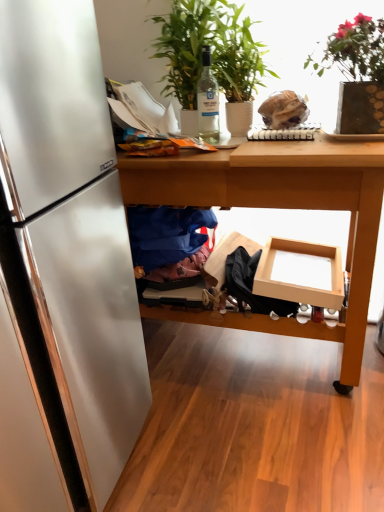
Question: Should I look upward or downward to see green leafy plant at upper center, placed as the first houseplant when sorted from left to right?

Choices:
 (A) up
 (B) down

Answer: (A)

Question: Should I look upward or downward to see blue fabric at lower center?

Choices:
 (A) down
 (B) up

Answer: (B)

Question: Would you say blue fabric at lower center is part of green leafy plant at upper center, placed as the first houseplant when sorted from left to right,'s contents?

Choices:
 (A) yes
 (B) no

Answer: (B)

Question: Is green leafy plant at upper center, placed as the first houseplant when sorted from left to right, thinner than blue fabric at lower center?

Choices:
 (A) yes
 (B) no

Answer: (B)

Question: Is green leafy plant at upper center, the second houseplant positioned from the right, oriented towards blue fabric at lower center?

Choices:
 (A) yes
 (B) no

Answer: (B)

Question: From a real-world perspective, is green leafy plant at upper center, the second houseplant positioned from the right, physically below blue fabric at lower center?

Choices:
 (A) no
 (B) yes

Answer: (A)

Question: From the image's perspective, does green leafy plant at upper center, the second houseplant positioned from the right, appear lower than blue fabric at lower center?

Choices:
 (A) no
 (B) yes

Answer: (A)

Question: Is green leafy plant at upper center, placed as the first houseplant when sorted from left to right, to the right of blue fabric at lower center from the viewer's perspective?

Choices:
 (A) yes
 (B) no

Answer: (A)

Question: Is green leafy plant at upper right, which is the 1th houseplant from right to left, looking in the opposite direction of green leafy plant at upper center, placed as the first houseplant when sorted from left to right?

Choices:
 (A) no
 (B) yes

Answer: (A)

Question: Does green leafy plant at upper right, which is the 1th houseplant from right to left, have a smaller size compared to green leafy plant at upper center, placed as the first houseplant when sorted from left to right?

Choices:
 (A) yes
 (B) no

Answer: (A)

Question: Is green leafy plant at upper right, which is the 1th houseplant from right to left, closer to the viewer compared to green leafy plant at upper center, placed as the first houseplant when sorted from left to right?

Choices:
 (A) no
 (B) yes

Answer: (B)

Question: From a real-world perspective, is green leafy plant at upper right, positioned as the second houseplant in left-to-right order, physically below green leafy plant at upper center, placed as the first houseplant when sorted from left to right?

Choices:
 (A) yes
 (B) no

Answer: (A)

Question: Does green leafy plant at upper right, positioned as the second houseplant in left-to-right order, touch green leafy plant at upper center, the second houseplant positioned from the right?

Choices:
 (A) yes
 (B) no

Answer: (B)

Question: Can you confirm if green leafy plant at upper right, which is the 1th houseplant from right to left, is taller than green leafy plant at upper center, the second houseplant positioned from the right?

Choices:
 (A) no
 (B) yes

Answer: (A)

Question: Can you confirm if wooden table at center is positioned to the left of blue fabric at lower center?

Choices:
 (A) no
 (B) yes

Answer: (A)